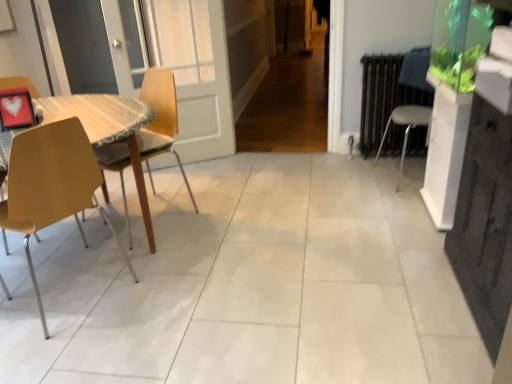
Question: Is the depth of white plastic chair at right, arranged as the 3th chair when viewed from the left, less than that of wooden at left, arranged as the second chair when viewed from the right?

Choices:
 (A) no
 (B) yes

Answer: (A)

Question: Is white plastic chair at right, arranged as the 1th chair when viewed from the right, touching wooden at left, the 2th chair in the left-to-right sequence?

Choices:
 (A) no
 (B) yes

Answer: (A)

Question: Is white plastic chair at right, arranged as the 3th chair when viewed from the left, turned away from wooden at left, the 2th chair in the left-to-right sequence?

Choices:
 (A) no
 (B) yes

Answer: (A)

Question: From the image's perspective, does white plastic chair at right, arranged as the 3th chair when viewed from the left, appear lower than wooden at left, arranged as the second chair when viewed from the right?

Choices:
 (A) yes
 (B) no

Answer: (B)

Question: Is white plastic chair at right, arranged as the 3th chair when viewed from the left, positioned beyond the bounds of wooden at left, the 2th chair in the left-to-right sequence?

Choices:
 (A) no
 (B) yes

Answer: (B)

Question: Is matte yellow chair at left, the 3th chair viewed from the right, bigger or smaller than white plastic chair at right, arranged as the 1th chair when viewed from the right?

Choices:
 (A) small
 (B) big

Answer: (A)

Question: From a real-world perspective, relative to white plastic chair at right, arranged as the 1th chair when viewed from the right, is matte yellow chair at left, placed as the 1th chair when sorted from left to right, vertically above or below?

Choices:
 (A) below
 (B) above

Answer: (B)

Question: Is point (41, 132) positioned closer to the camera than point (415, 86)?

Choices:
 (A) closer
 (B) farther

Answer: (A)

Question: Would you say matte yellow chair at left, the 3th chair viewed from the right, is inside or outside white plastic chair at right, arranged as the 1th chair when viewed from the right?

Choices:
 (A) outside
 (B) inside

Answer: (A)

Question: Is point (72, 193) positioned closer to the camera than point (155, 91)?

Choices:
 (A) farther
 (B) closer

Answer: (B)

Question: From the image's perspective, relative to wooden at left, the 2th chair in the left-to-right sequence, is matte yellow chair at left, placed as the 1th chair when sorted from left to right, above or below?

Choices:
 (A) below
 (B) above

Answer: (A)

Question: Considering their positions, is matte yellow chair at left, the 3th chair viewed from the right, located in front of or behind wooden at left, the 2th chair in the left-to-right sequence?

Choices:
 (A) front
 (B) behind

Answer: (A)

Question: From a real-world perspective, is matte yellow chair at left, the 3th chair viewed from the right, positioned above or below wooden at left, the 2th chair in the left-to-right sequence?

Choices:
 (A) above
 (B) below

Answer: (A)

Question: Is white plastic chair at right, arranged as the 3th chair when viewed from the left, to the left or to the right of wooden at left, the 2th chair in the left-to-right sequence, in the image?

Choices:
 (A) left
 (B) right

Answer: (B)

Question: Considering their positions, is white plastic chair at right, arranged as the 3th chair when viewed from the left, located in front of or behind wooden at left, arranged as the second chair when viewed from the right?

Choices:
 (A) behind
 (B) front

Answer: (A)